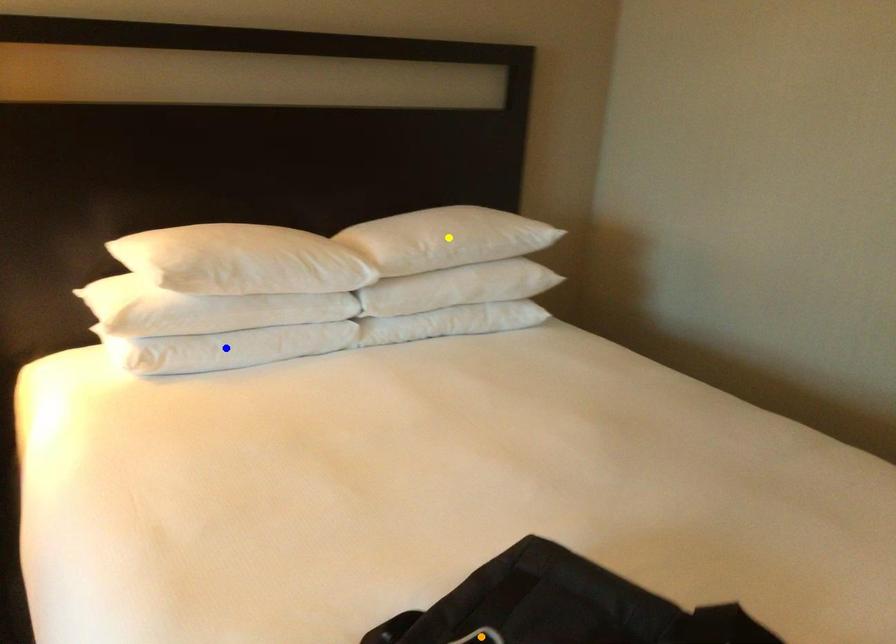
Based on the photo, order these from nearest to farthest:
yellow point
orange point
blue point

orange point → blue point → yellow point